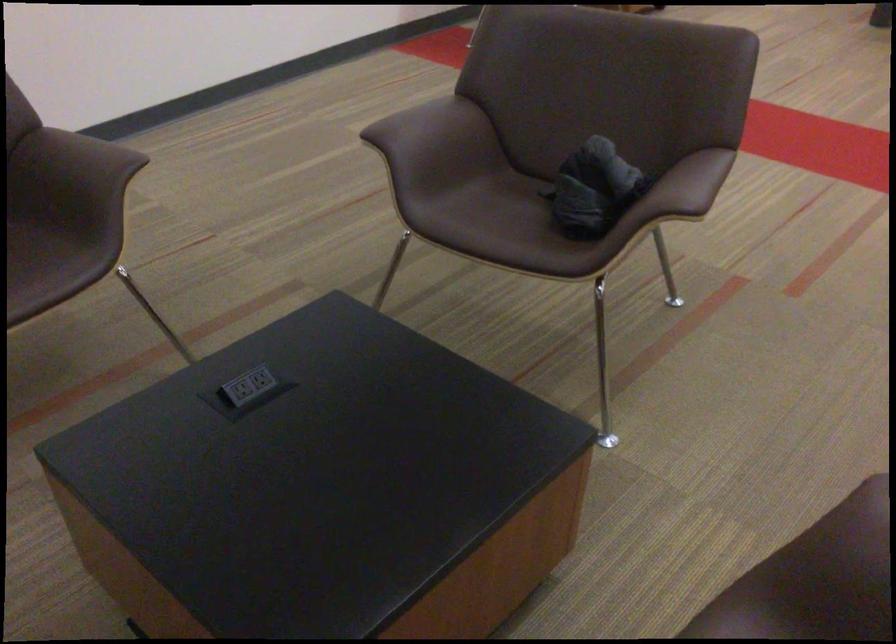
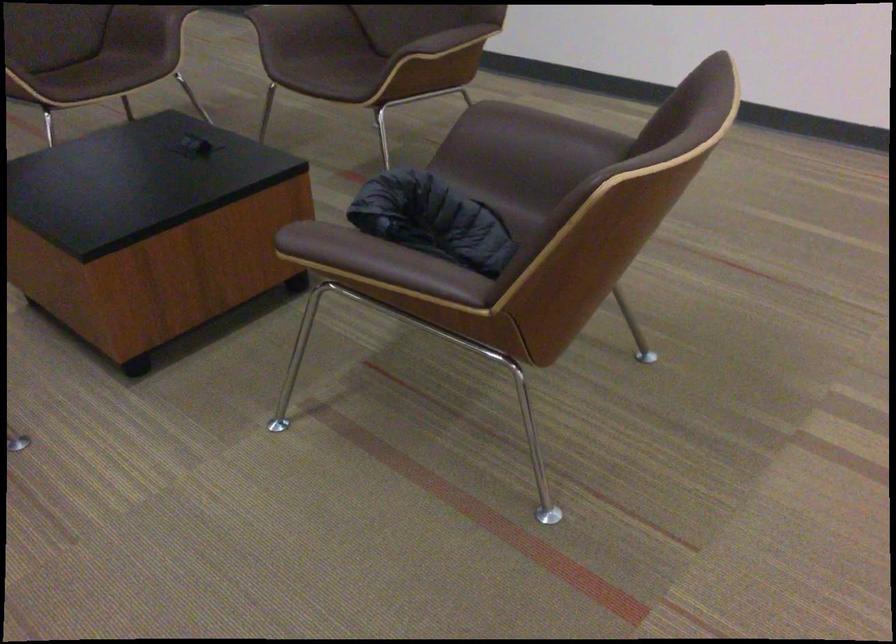
In the second image, find the point that corresponds to [428,118] in the first image.

(545, 128)